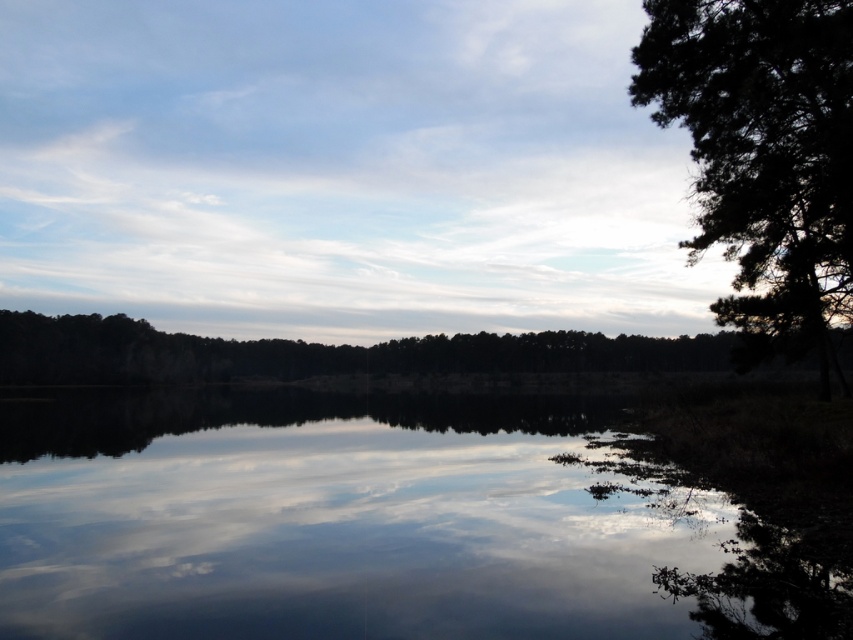
Question: Is smooth reflective water at center above dark green textured tree at right?

Choices:
 (A) no
 (B) yes

Answer: (A)

Question: Does smooth reflective water at center appear on the left side of dark green textured tree at right?

Choices:
 (A) yes
 (B) no

Answer: (A)

Question: Can you confirm if smooth reflective water at center is positioned to the left of dark green textured tree at right?

Choices:
 (A) no
 (B) yes

Answer: (B)

Question: Which point is closer to the camera?

Choices:
 (A) smooth reflective water at center
 (B) dark green textured tree at right

Answer: (A)

Question: Which of the following is the closest to the observer?

Choices:
 (A) dark green textured tree at right
 (B) smooth reflective water at center

Answer: (B)